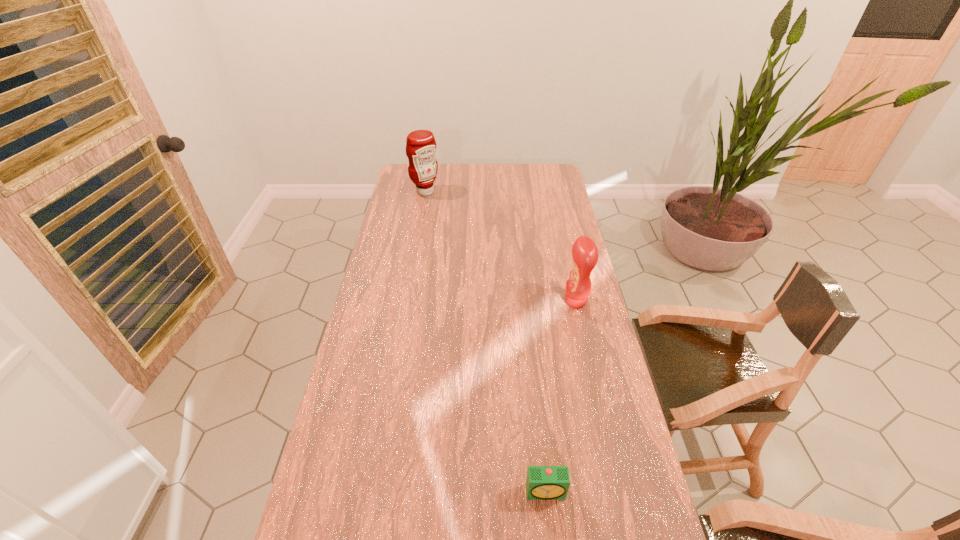
Locate an element on the screen. This screenshot has width=960, height=540. vacant space that's between the left condiment and the alarm clock is located at coordinates (486, 342).

The image size is (960, 540). I want to click on free space between the leftmost object and the second farthest object, so coord(500,246).

Image resolution: width=960 pixels, height=540 pixels. Find the location of `free space between the rightmost object and the farther condiment`. free space between the rightmost object and the farther condiment is located at coordinates (500, 246).

Locate an element on the screen. Image resolution: width=960 pixels, height=540 pixels. vacant space that's between the rightmost object and the second object from left to right is located at coordinates (561, 397).

At what (x,y) coordinates should I click in order to perform the action: click on free spot between the rightmost object and the leftmost object. Please return your answer as a coordinate pair (x, y). Looking at the image, I should click on (500, 246).

Image resolution: width=960 pixels, height=540 pixels. Find the location of `unoccupied position between the farthest object and the nearer condiment`. unoccupied position between the farthest object and the nearer condiment is located at coordinates (500, 246).

Find the location of a particular element. free space between the rightmost object and the second object from right to left is located at coordinates (561, 397).

Find the location of `free space between the farther condiment and the nearest object`. free space between the farther condiment and the nearest object is located at coordinates (486, 342).

Identify the location of vacant area between the right condiment and the leftmost object. (500, 246).

Identify which object is located as the nearest to the rightmost object. Please provide its 2D coordinates. Your answer should be formatted as a tuple, i.e. [(x, y)], where the tuple contains the x and y coordinates of a point satisfying the conditions above.

[(543, 482)]